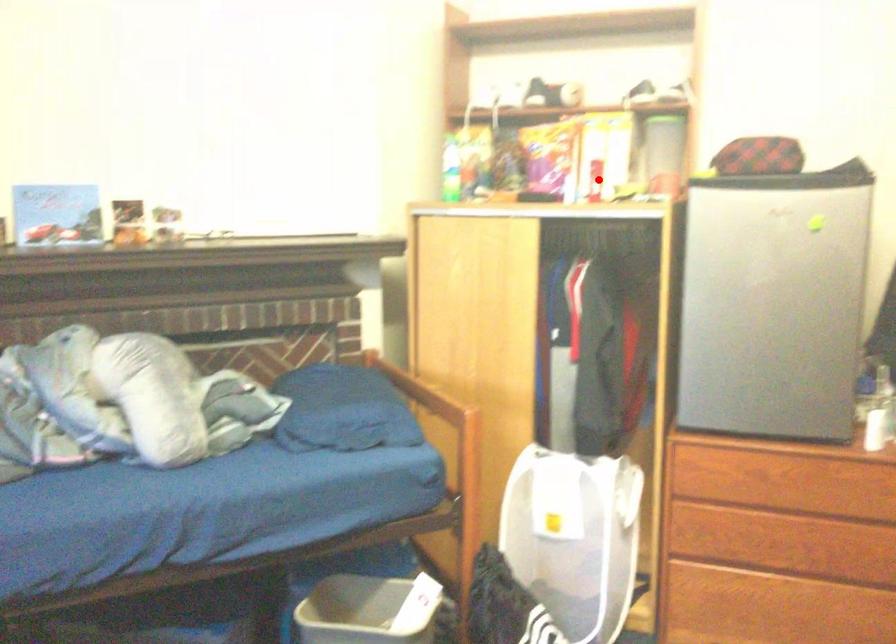
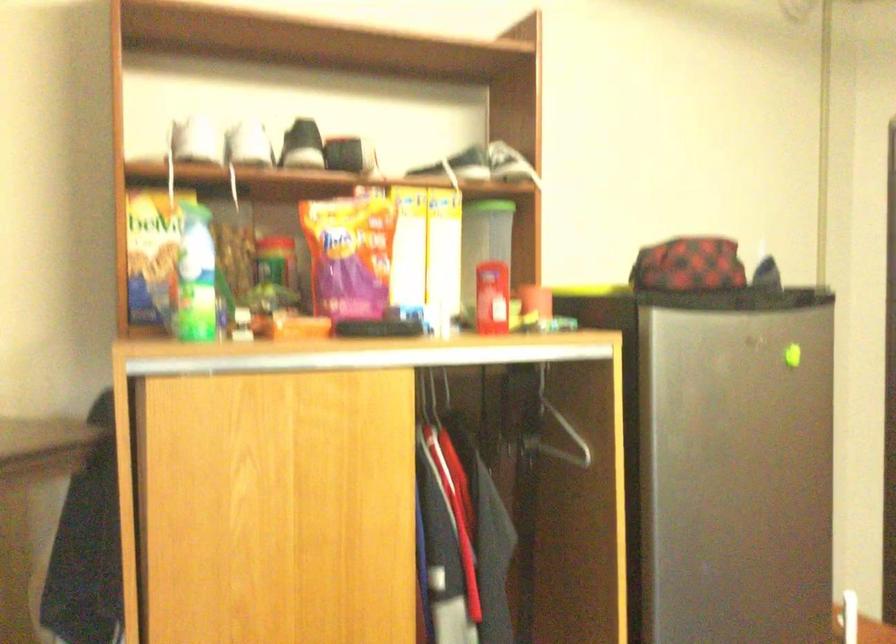
Where in the second image is the point corresponding to the highlighted location from the first image?

(492, 297)